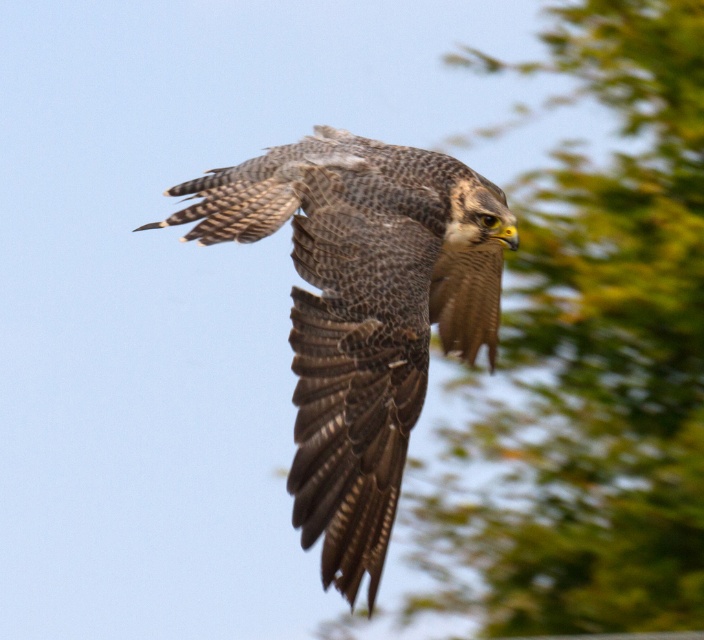
Question: Observing the image, what is the correct spatial positioning of green leafy tree at upper right in reference to speckled feathered falcon at center?

Choices:
 (A) right
 (B) left

Answer: (A)

Question: Which object appears closest to the camera in this image?

Choices:
 (A) green leafy tree at upper right
 (B) speckled feathered falcon at center

Answer: (B)

Question: Does green leafy tree at upper right appear under speckled feathered falcon at center?

Choices:
 (A) yes
 (B) no

Answer: (A)

Question: Among these objects, which one is farthest from the camera?

Choices:
 (A) speckled feathered falcon at center
 (B) green leafy tree at upper right

Answer: (B)

Question: From the image, what is the correct spatial relationship of green leafy tree at upper right in relation to speckled feathered falcon at center?

Choices:
 (A) above
 (B) below

Answer: (B)